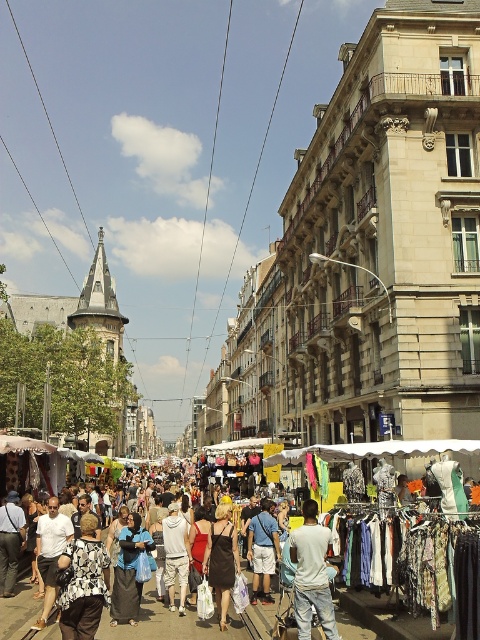
Measure the distance from white cotton shirt at center to dark blue fabric at center.

They are 43.78 feet apart.

The image size is (480, 640). What do you see at coordinates (312, 573) in the screenshot? I see `white cotton shirt at center` at bounding box center [312, 573].

I want to click on white cotton shirt at center, so click(x=312, y=573).

Measure the distance from dark blue fabric at center to light blue denim shorts at center.

They are 10.32 meters apart.

Who is higher up, dark blue fabric at center or light blue denim shorts at center?

Positioned higher is dark blue fabric at center.

Does point (128, 577) lie behind point (264, 592)?

No, it is not.

The image size is (480, 640). I want to click on dark blue fabric at center, so click(129, 572).

Measure the distance between white fabric clothing at center and camera.

white fabric clothing at center and camera are 160.98 feet apart.

Image resolution: width=480 pixels, height=640 pixels. What do you see at coordinates (159, 625) in the screenshot?
I see `white fabric clothing at center` at bounding box center [159, 625].

In order to click on white fabric clothing at center in this screenshot , I will do `click(159, 625)`.